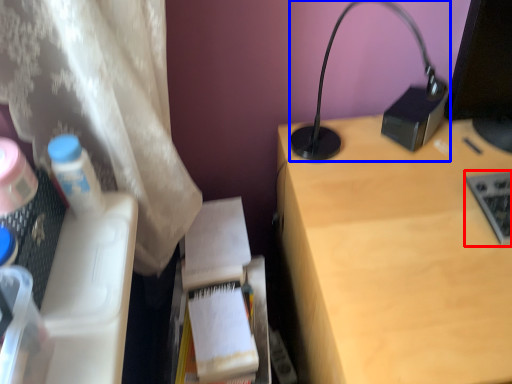
Question: Which object is further to the camera taking this photo, laptop keyboard (highlighted by a red box) or lamp (highlighted by a blue box)?

Choices:
 (A) laptop keyboard
 (B) lamp

Answer: (A)